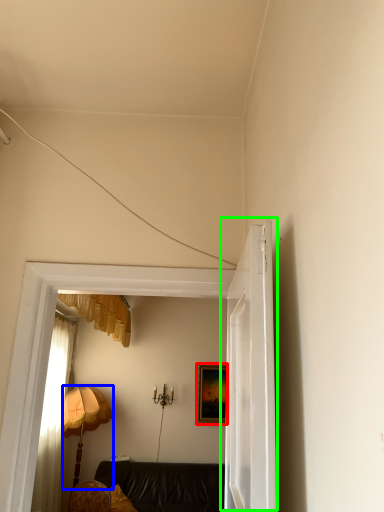
Question: Estimate the real-world distances between objects in this image. Which object is closer to picture frame (highlighted by a red box), lamp (highlighted by a blue box) or door (highlighted by a green box)?

Choices:
 (A) lamp
 (B) door

Answer: (A)